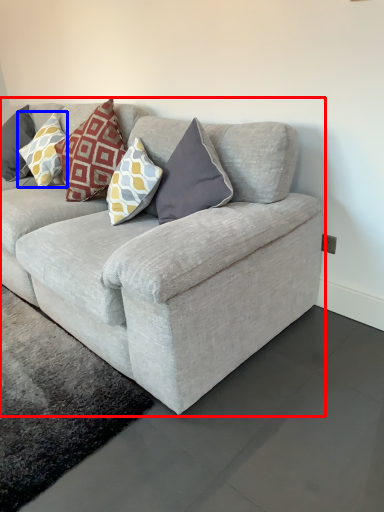
Question: Among these objects, which one is nearest to the camera, studio couch (highlighted by a red box) or pillow (highlighted by a blue box)?

Choices:
 (A) studio couch
 (B) pillow

Answer: (A)